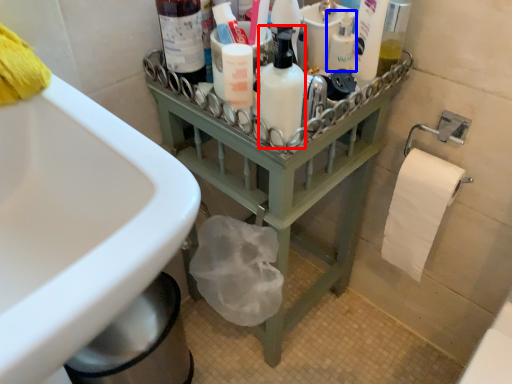
Question: Which object appears farthest to the camera in this image, cleaning product (highlighted by a red box) or mouthwash (highlighted by a blue box)?

Choices:
 (A) cleaning product
 (B) mouthwash

Answer: (B)